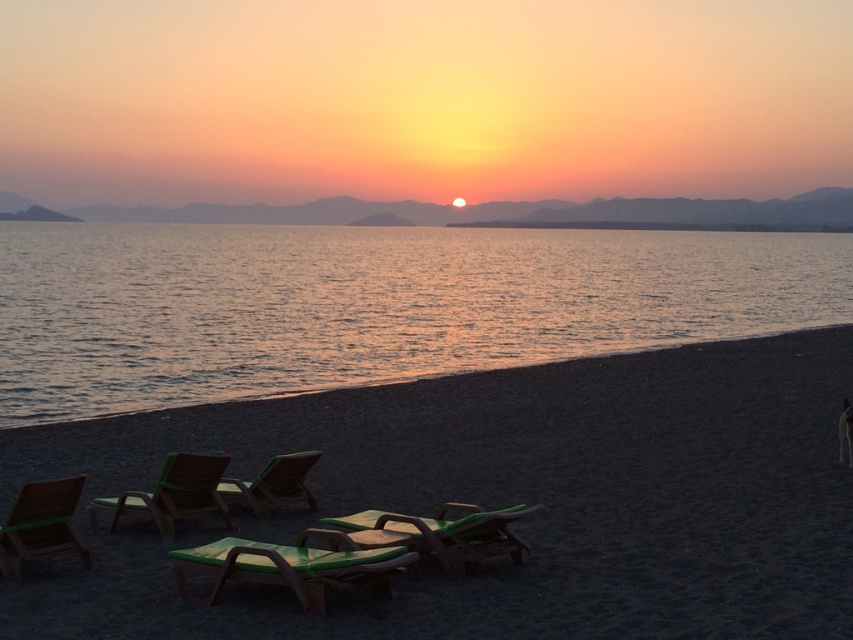
You are standing on the beach and want to sit down. You see the green plastic beach chair at center and the green fabric beach chair at center. Which one is closer to you?

The green plastic beach chair at center is closer to the viewer than the green fabric beach chair at center.